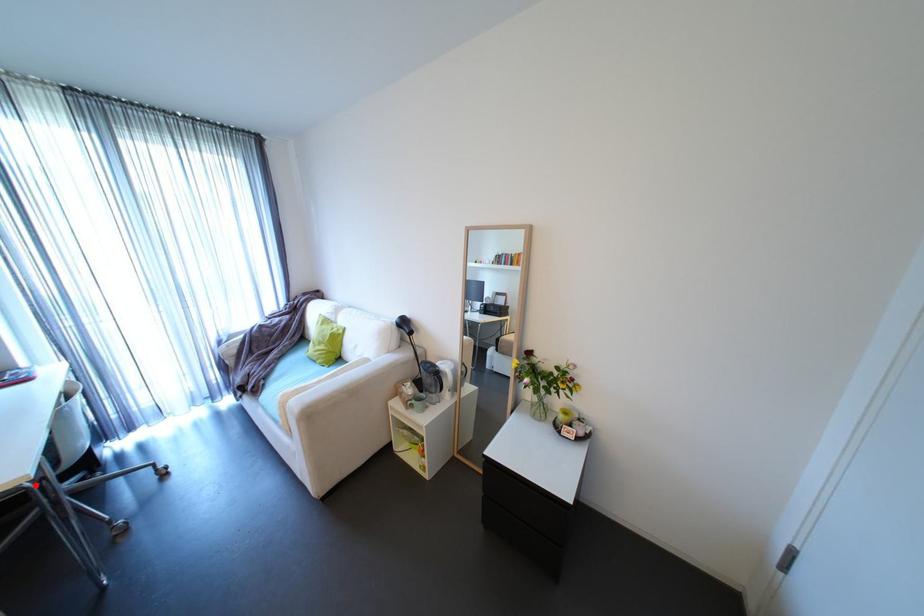
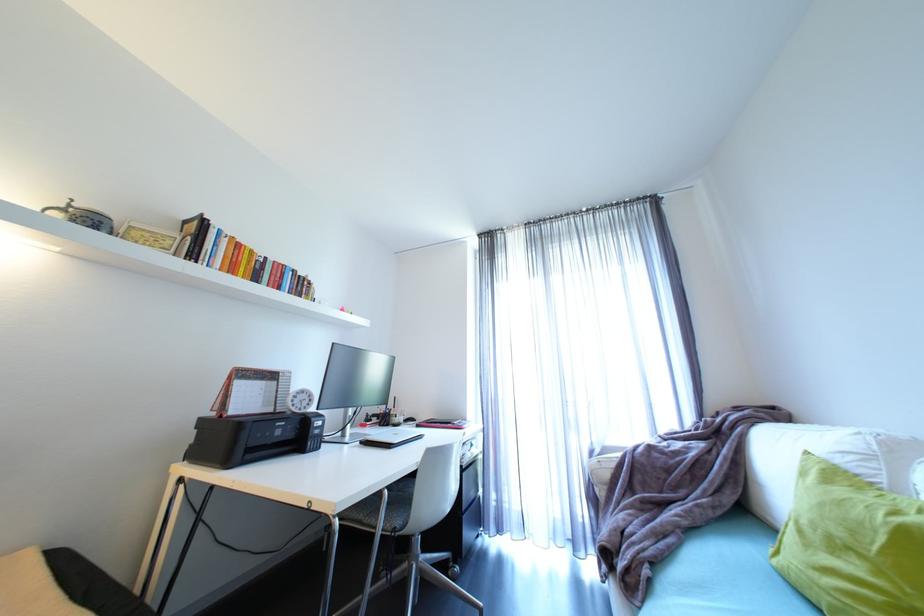
Locate, in the second image, the point that corresponds to the highlighted location in the first image.

(344, 522)